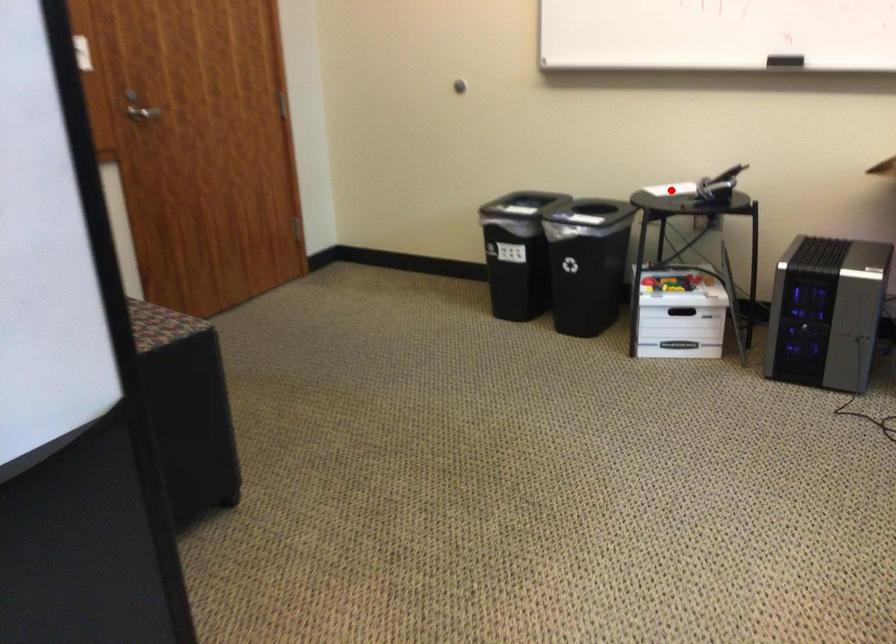
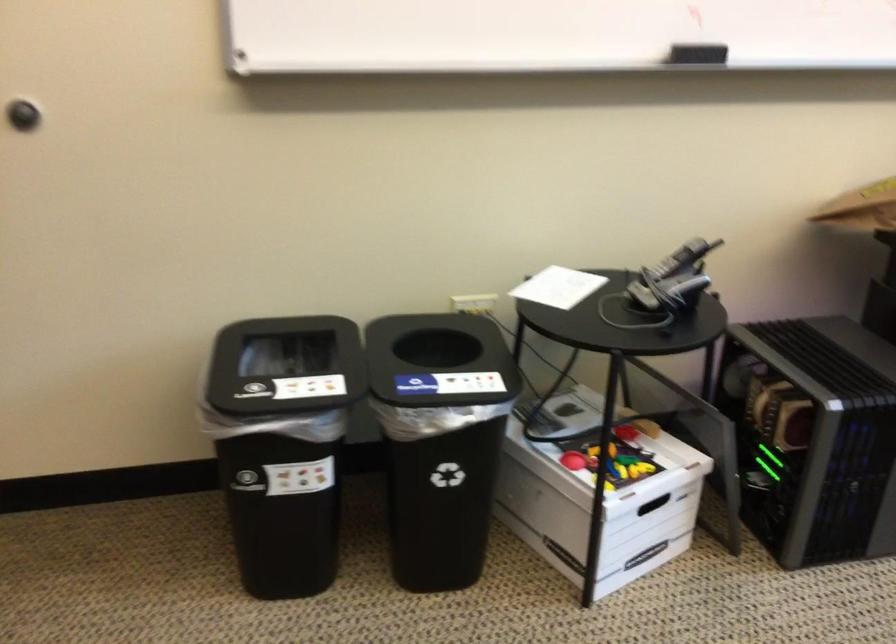
In the second image, find the point that corresponds to the highlighted location in the first image.

(558, 287)